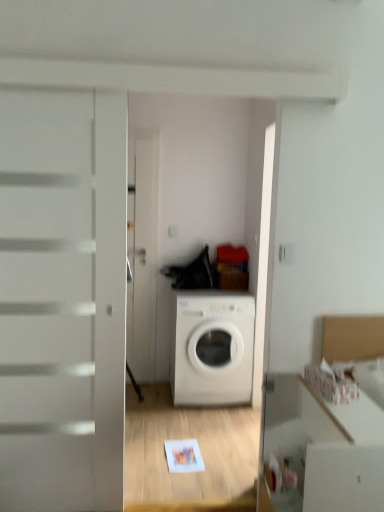
Question: From a real-world perspective, relative to white glossy washing machine at center, is white glossy cabinet at lower right vertically above or below?

Choices:
 (A) below
 (B) above

Answer: (B)

Question: Considering their positions, is white glossy cabinet at lower right located in front of or behind white glossy washing machine at center?

Choices:
 (A) behind
 (B) front

Answer: (B)

Question: Considering the positions of point (339, 351) and point (200, 346), is point (339, 351) closer or farther from the camera than point (200, 346)?

Choices:
 (A) farther
 (B) closer

Answer: (B)

Question: Is point pyautogui.click(x=210, y=330) closer or farther from the camera than point pyautogui.click(x=380, y=353)?

Choices:
 (A) farther
 (B) closer

Answer: (A)

Question: Looking at their shapes, would you say white glossy washing machine at center is wider or thinner than white glossy cabinet at lower right?

Choices:
 (A) thin
 (B) wide

Answer: (B)

Question: In terms of size, does white glossy washing machine at center appear bigger or smaller than white glossy cabinet at lower right?

Choices:
 (A) big
 (B) small

Answer: (A)

Question: From a real-world perspective, is white glossy washing machine at center physically located above or below white glossy cabinet at lower right?

Choices:
 (A) below
 (B) above

Answer: (A)